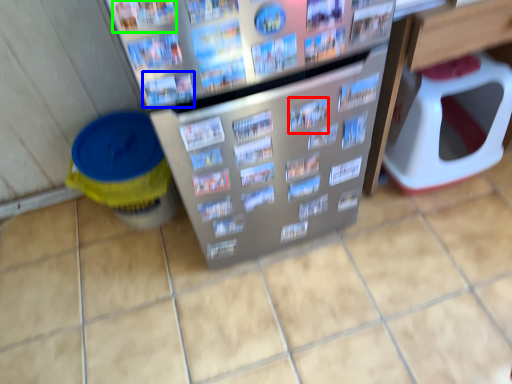
Question: Based on their relative distances, which object is farther from magazine (highlighted by a red box)? Choose from magazine (highlighted by a blue box) and magazine (highlighted by a green box).

Choices:
 (A) magazine
 (B) magazine

Answer: (B)